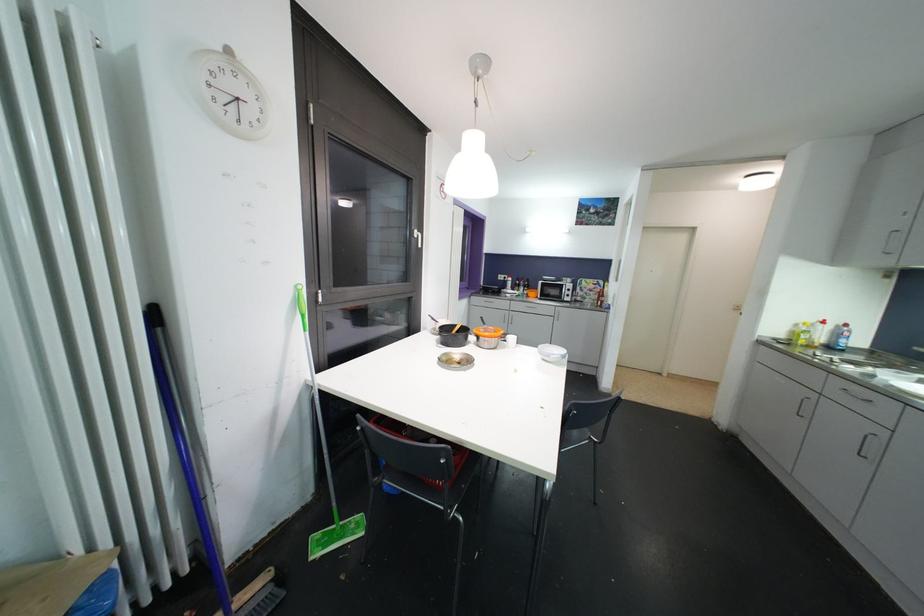
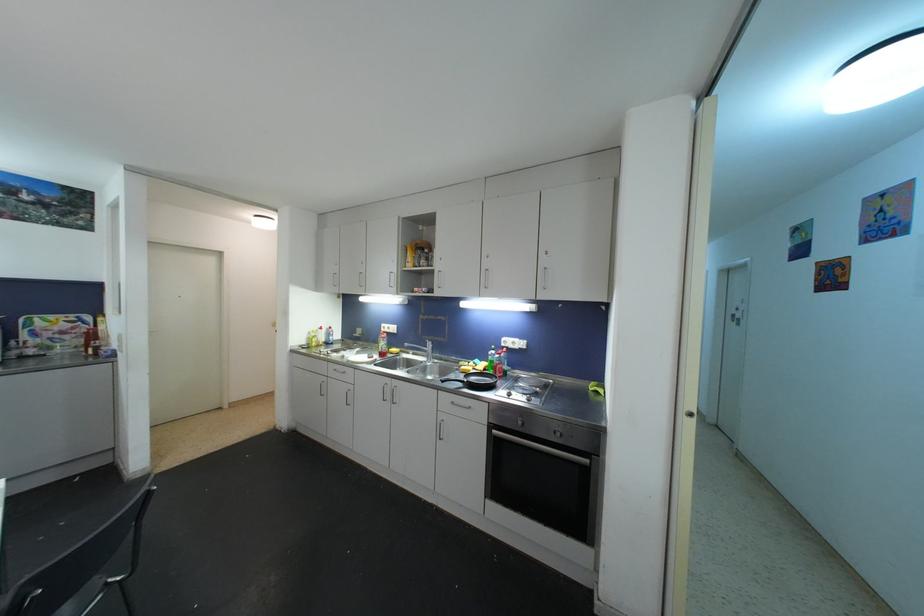
Question: Based on the continuous images, in which direction is the camera rotating? Reply with the corresponding letter.

Choices:
 (A) Left
 (B) Right
 (C) Up
 (D) Down

Answer: (B)